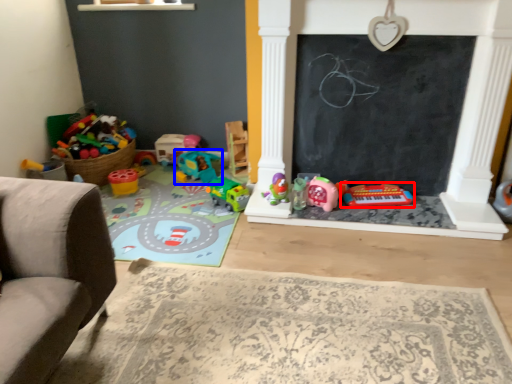
Question: Which of the following is the closest to the observer, toy (highlighted by a red box) or toy (highlighted by a blue box)?

Choices:
 (A) toy
 (B) toy

Answer: (A)